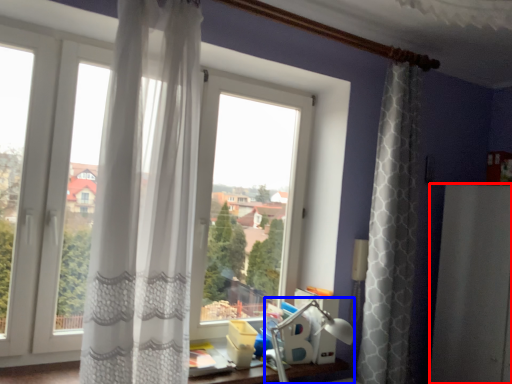
Question: Among these objects, which one is farthest to the camera, screen door (highlighted by a red box) or table lamp (highlighted by a blue box)?

Choices:
 (A) screen door
 (B) table lamp

Answer: (A)